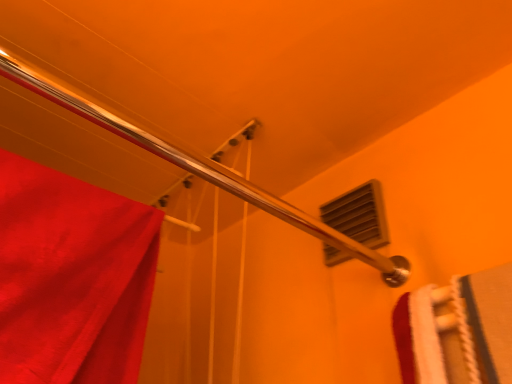
Question: Is shiny metallic shower at upper left positioned in front of matte plastic vent at upper right?

Choices:
 (A) no
 (B) yes

Answer: (B)

Question: Can you see shiny metallic shower at upper left touching matte plastic vent at upper right?

Choices:
 (A) yes
 (B) no

Answer: (B)

Question: From a real-world perspective, is shiny metallic shower at upper left positioned under matte plastic vent at upper right based on gravity?

Choices:
 (A) yes
 (B) no

Answer: (B)

Question: Is shiny metallic shower at upper left thinner than matte plastic vent at upper right?

Choices:
 (A) yes
 (B) no

Answer: (B)

Question: Is shiny metallic shower at upper left not inside matte plastic vent at upper right?

Choices:
 (A) no
 (B) yes

Answer: (B)

Question: From a real-world perspective, does shiny metallic shower at upper left stand above matte plastic vent at upper right?

Choices:
 (A) no
 (B) yes

Answer: (B)

Question: Does matte plastic vent at upper right have a lesser width compared to shiny metallic shower at upper left?

Choices:
 (A) yes
 (B) no

Answer: (A)

Question: Is matte plastic vent at upper right positioned with its back to shiny metallic shower at upper left?

Choices:
 (A) yes
 (B) no

Answer: (B)

Question: Considering the relative sizes of matte plastic vent at upper right and shiny metallic shower at upper left in the image provided, is matte plastic vent at upper right taller than shiny metallic shower at upper left?

Choices:
 (A) no
 (B) yes

Answer: (B)

Question: Does matte plastic vent at upper right appear on the left side of shiny metallic shower at upper left?

Choices:
 (A) yes
 (B) no

Answer: (B)

Question: From a real-world perspective, is matte plastic vent at upper right beneath shiny metallic shower at upper left?

Choices:
 (A) yes
 (B) no

Answer: (A)

Question: From the image's perspective, does matte plastic vent at upper right appear higher than shiny metallic shower at upper left?

Choices:
 (A) no
 (B) yes

Answer: (A)

Question: Looking at the image, does shiny metallic shower at upper left seem bigger or smaller compared to matte plastic vent at upper right?

Choices:
 (A) big
 (B) small

Answer: (A)